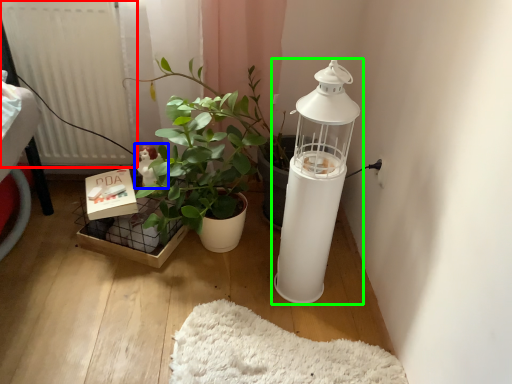
Question: Considering the real-world distances, which object is closest to radiator (highlighted by a red box)? toy (highlighted by a blue box) or lamp (highlighted by a green box).

Choices:
 (A) toy
 (B) lamp

Answer: (A)